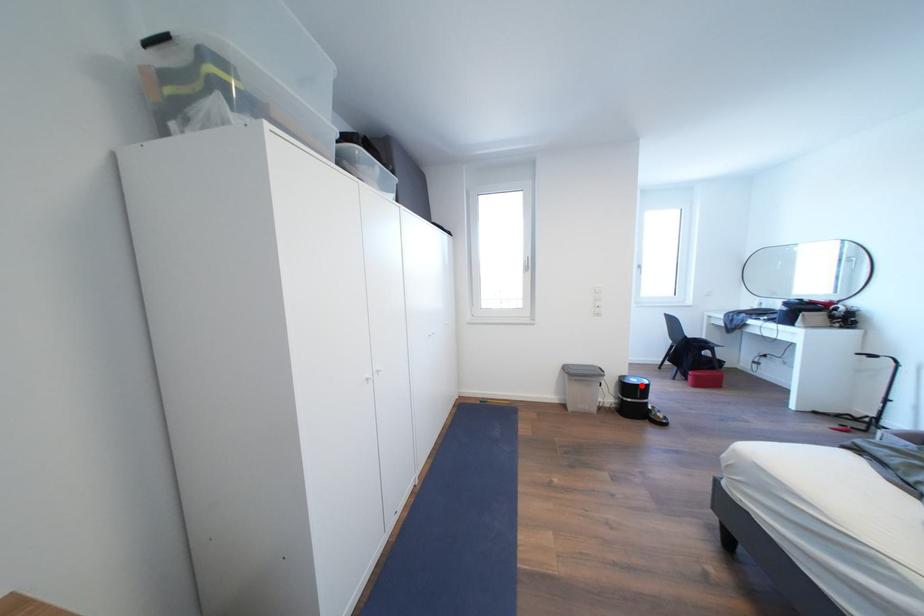
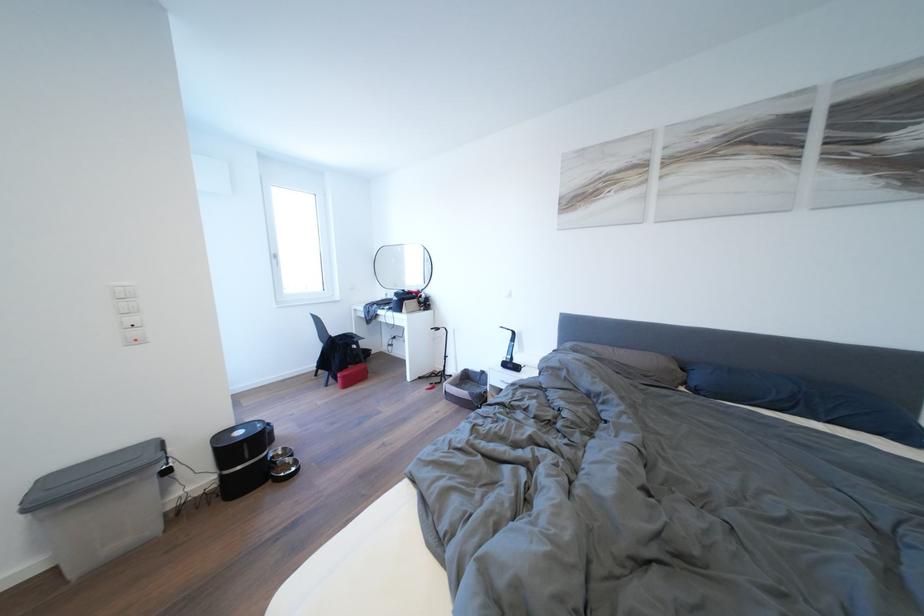
Question: A red point is marked in image1. In image2, is the corresponding 3D point closer to the camera or farther? Reply with the corresponding letter.

Choices:
 (A) The corresponding 3D point is closer.
 (B) The corresponding 3D point is farther.

Answer: (A)